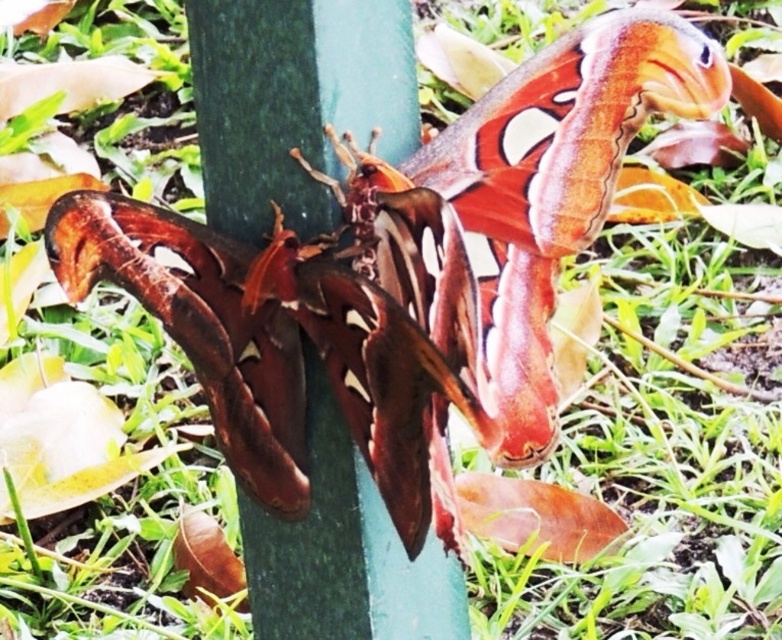
Can you confirm if green smooth pole at center is positioned to the left of matte brown butterfly at center?

In fact, green smooth pole at center is to the right of matte brown butterfly at center.

Image resolution: width=782 pixels, height=640 pixels. Find the location of `green smooth pole at center`. green smooth pole at center is located at coordinates (293, 100).